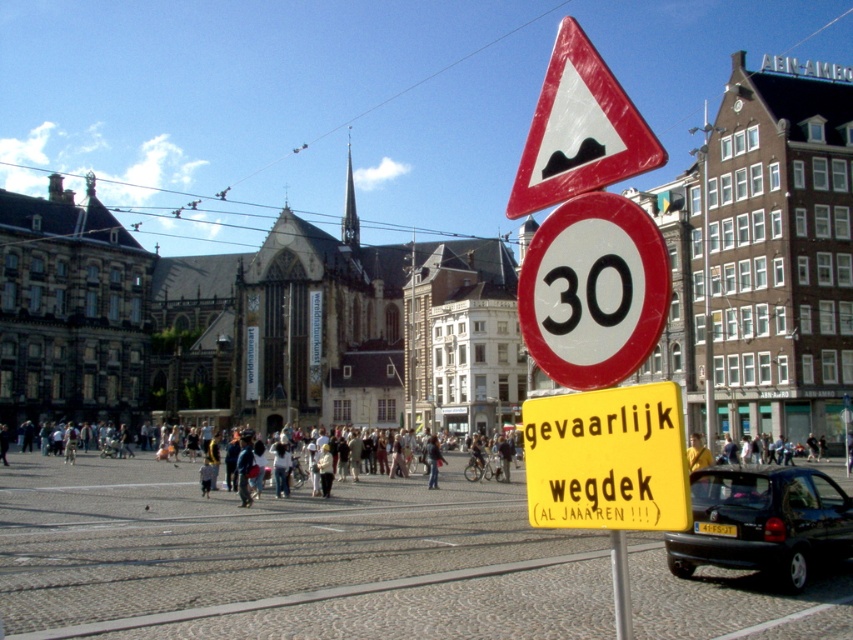
Question: Which object is farther from the camera taking this photo?

Choices:
 (A) yellow paper sign at center
 (B) metallic pole at center
 (C) black matte car at lower right
 (D) white glossy speed limit sign at center

Answer: (C)

Question: From the image, what is the correct spatial relationship of black matte car at lower right in relation to red plastic triangle at upper center?

Choices:
 (A) right
 (B) left

Answer: (A)

Question: Which point is farther to the camera?

Choices:
 (A) (560, 364)
 (B) (677, 547)

Answer: (B)

Question: From the image, what is the correct spatial relationship of black matte car at lower right in relation to denim jacket at center?

Choices:
 (A) right
 (B) left

Answer: (A)

Question: Can you confirm if yellow paper sign at center is positioned below red plastic triangle at upper center?

Choices:
 (A) yes
 (B) no

Answer: (A)

Question: Which object is the closest to the metallic pole at center?

Choices:
 (A) red plastic triangle at upper center
 (B) yellow paper sign at center
 (C) denim jacket at center

Answer: (B)